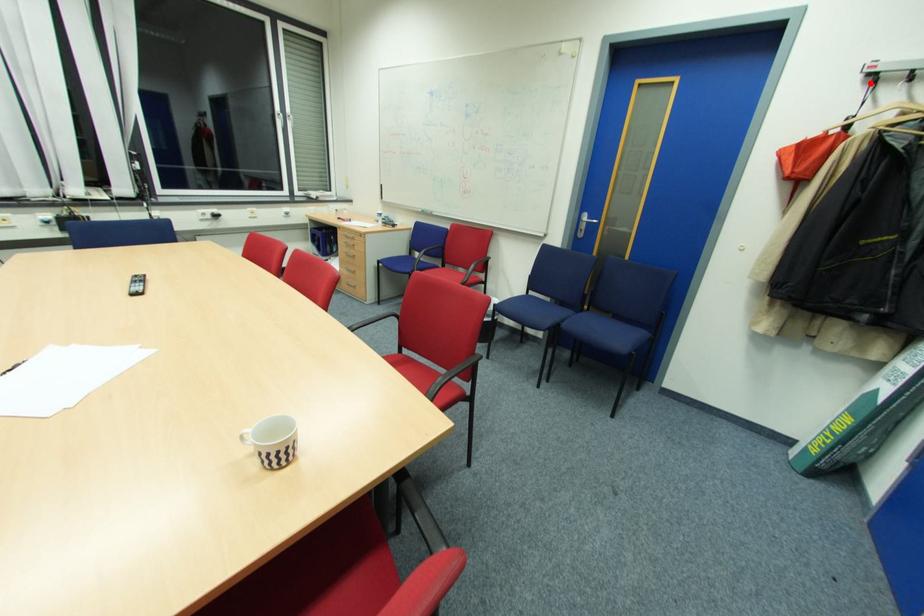
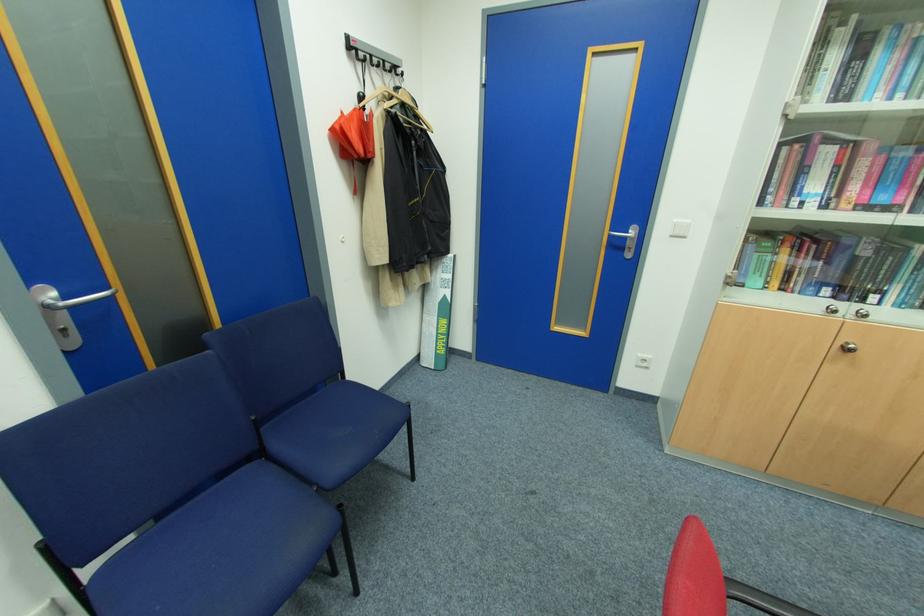
In the second image, find the point that corresponds to the highlighted location in the first image.

(353, 55)